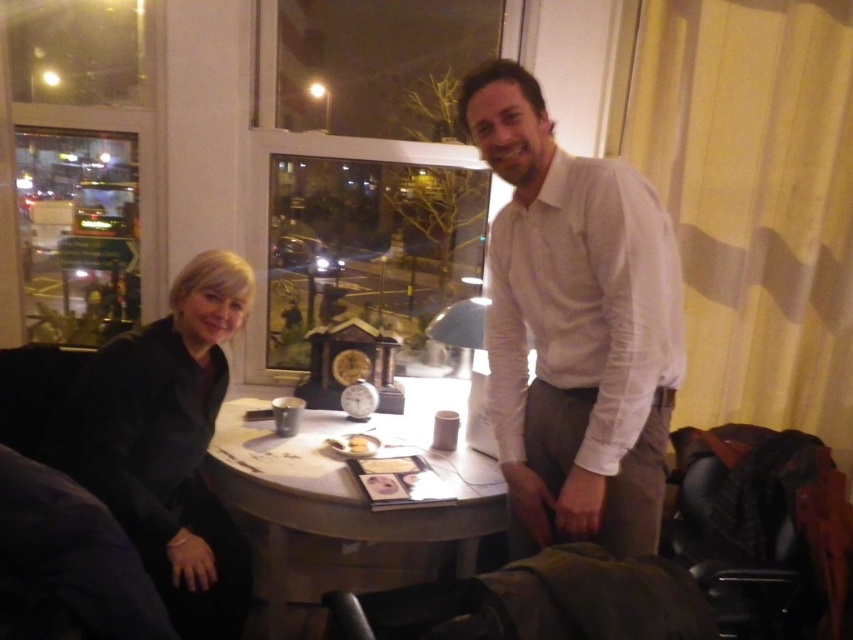
You are standing in the scene and want to reach the point marked as point [485,189]. If your arm can reach 2 meters, can you touch it without moving your feet?

The point [485,189] is 2.51 meters away from the viewer. Since your arm can only reach 2 meters, you cannot touch it without moving your feet.